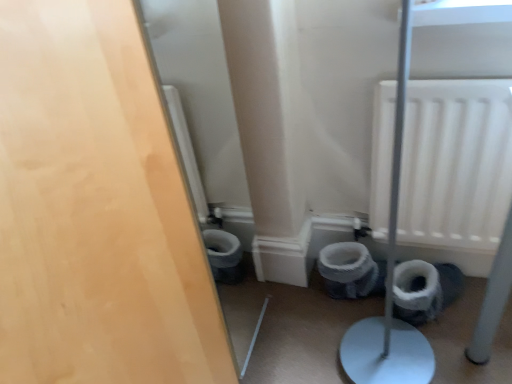
Image resolution: width=512 pixels, height=384 pixels. Find the location of `white fabric toilet bowl at lower center`. white fabric toilet bowl at lower center is located at coordinates (347, 270).

At what (x,y) coordinates should I click in order to perform the action: click on white matte radiator at upper right. Please return your answer as a coordinate pair (x, y). The image size is (512, 384). Looking at the image, I should click on (456, 164).

Locate an element on the screen. white fabric toilet bowl at lower center is located at coordinates (347, 270).

Between matte wood door at left and white textured toilet paper at lower right, which one has larger width?

matte wood door at left.

Is matte wood door at left positioned with its back to white textured toilet paper at lower right?

matte wood door at left is not turned away from white textured toilet paper at lower right.

Based on the photo, from a real-world perspective, is matte wood door at left above or below white textured toilet paper at lower right?

Clearly, from a real-world perspective, matte wood door at left is above white textured toilet paper at lower right.

The height and width of the screenshot is (384, 512). Identify the location of door above the white textured toilet paper at lower right (from the image's perspective). (95, 210).

Identify the location of toilet bowl located behind the matte wood door at left. The height and width of the screenshot is (384, 512). (347, 270).

In the scene shown: Could you tell me if matte wood door at left is facing white fabric toilet bowl at lower center?

Yes, matte wood door at left is facing white fabric toilet bowl at lower center.

Is matte wood door at left shorter than white fabric toilet bowl at lower center?

In fact, matte wood door at left may be taller than white fabric toilet bowl at lower center.

From a real-world perspective, is matte wood door at left on white fabric toilet bowl at lower center?

Yes, from a real-world perspective, matte wood door at left is over white fabric toilet bowl at lower center

Locate an element on the screen. Image resolution: width=512 pixels, height=384 pixels. radiator behind the matte wood door at left is located at coordinates tap(456, 164).

Between white matte radiator at upper right and matte wood door at left, which one has larger width?

white matte radiator at upper right is wider.

From a real-world perspective, which object stands above the other?

From a 3D spatial view, matte wood door at left is above.

How far apart are white matte radiator at upper right and matte wood door at left?

They are 28.29 inches apart.

Is white textured toilet paper at lower right oriented towards matte wood door at left?

Yes, white textured toilet paper at lower right is aimed at matte wood door at left.

From a real-world perspective, is white textured toilet paper at lower right physically above matte wood door at left?

Incorrect, from a real-world perspective, white textured toilet paper at lower right is lower than matte wood door at left.

In the scene shown: Is white textured toilet paper at lower right to the right of matte wood door at left from the viewer's perspective?

Correct, you'll find white textured toilet paper at lower right to the right of matte wood door at left.

From the image's perspective, which object appears higher, white textured toilet paper at lower right or matte wood door at left?

matte wood door at left, from the image's perspective.

Can white fabric toilet bowl at lower center be found inside white textured toilet paper at lower right?

No, white fabric toilet bowl at lower center is not a part of white textured toilet paper at lower right.

Locate an element on the screen. The image size is (512, 384). toilet bowl on the left of white textured toilet paper at lower right is located at coordinates coord(347,270).

Between white textured toilet paper at lower right and white fabric toilet bowl at lower center, which one has larger size?

white fabric toilet bowl at lower center is bigger.

Which of these two, white textured toilet paper at lower right or white fabric toilet bowl at lower center, is wider?

white fabric toilet bowl at lower center is wider.

From a real-world perspective, who is located lower, white fabric toilet bowl at lower center or white matte radiator at upper right?

white fabric toilet bowl at lower center, from a real-world perspective.

Is white fabric toilet bowl at lower center located outside white matte radiator at upper right?

Yes, white fabric toilet bowl at lower center is not within white matte radiator at upper right.

Considering the relative positions of white fabric toilet bowl at lower center and white matte radiator at upper right in the image provided, is white fabric toilet bowl at lower center to the left of white matte radiator at upper right from the viewer's perspective?

Indeed, white fabric toilet bowl at lower center is positioned on the left side of white matte radiator at upper right.

Between white fabric toilet bowl at lower center and white matte radiator at upper right, which one has larger width?

white matte radiator at upper right is wider.

Is white textured toilet paper at lower right behind white matte radiator at upper right?

Yes, the depth of white textured toilet paper at lower right is greater than that of white matte radiator at upper right.

Is white textured toilet paper at lower right not inside white matte radiator at upper right?

That's correct, white textured toilet paper at lower right is outside of white matte radiator at upper right.

Considering the sizes of objects white textured toilet paper at lower right and white matte radiator at upper right in the image provided, who is thinner, white textured toilet paper at lower right or white matte radiator at upper right?

white textured toilet paper at lower right.

Does point (408, 274) appear closer or farther from the camera than point (442, 220)?

Point (408, 274) is positioned farther from the camera compared to point (442, 220).

You are a GUI agent. You are given a task and a screenshot of the screen. Output one action in this format:
    pyautogui.click(x=<x>, y=<y>)
    Task: Click on the door on the left of the white textured toilet paper at lower right
    This screenshot has width=512, height=384.
    Given the screenshot: What is the action you would take?
    pyautogui.click(x=95, y=210)

Find the location of a particular element. door above the white fabric toilet bowl at lower center (from the image's perspective) is located at coordinates (95, 210).

When comparing their distances from white fabric toilet bowl at lower center, does white matte radiator at upper right or matte wood door at left seem further?

Among the two, matte wood door at left is located further to white fabric toilet bowl at lower center.

Based on their spatial positions, is white fabric toilet bowl at lower center or white matte radiator at upper right closer to white textured toilet paper at lower right?

white fabric toilet bowl at lower center is closer to white textured toilet paper at lower right.

From the image, which object appears to be nearer to white textured toilet paper at lower right, white matte radiator at upper right or white fabric toilet bowl at lower center?

The object closer to white textured toilet paper at lower right is white fabric toilet bowl at lower center.

Estimate the real-world distances between objects in this image. Which object is closer to white fabric toilet bowl at lower center, matte wood door at left or white textured toilet paper at lower right?

Based on the image, white textured toilet paper at lower right appears to be nearer to white fabric toilet bowl at lower center.

Which object lies nearer to the anchor point white matte radiator at upper right, white fabric toilet bowl at lower center or white textured toilet paper at lower right?

white textured toilet paper at lower right lies closer to white matte radiator at upper right than the other object.

Based on their spatial positions, is matte wood door at left or white textured toilet paper at lower right further from white matte radiator at upper right?

matte wood door at left is positioned further to the anchor white matte radiator at upper right.

Looking at the image, which one is located further to white matte radiator at upper right, white textured toilet paper at lower right or matte wood door at left?

matte wood door at left is further to white matte radiator at upper right.

From the image, which object appears to be nearer to white textured toilet paper at lower right, white fabric toilet bowl at lower center or matte wood door at left?

Among the two, white fabric toilet bowl at lower center is located nearer to white textured toilet paper at lower right.

The width and height of the screenshot is (512, 384). I want to click on toilet bowl between white matte radiator at upper right and white textured toilet paper at lower right vertically, so click(x=347, y=270).

Identify the location of toilet paper located between matte wood door at left and white fabric toilet bowl at lower center in the depth direction. The image size is (512, 384). (415, 282).

At what (x,y) coordinates should I click in order to perform the action: click on radiator located between matte wood door at left and white fabric toilet bowl at lower center in the depth direction. Please return your answer as a coordinate pair (x, y). Image resolution: width=512 pixels, height=384 pixels. Looking at the image, I should click on (456, 164).

At what (x,y) coordinates should I click in order to perform the action: click on toilet paper situated between matte wood door at left and white matte radiator at upper right from left to right. Please return your answer as a coordinate pair (x, y). The width and height of the screenshot is (512, 384). Looking at the image, I should click on (415, 282).